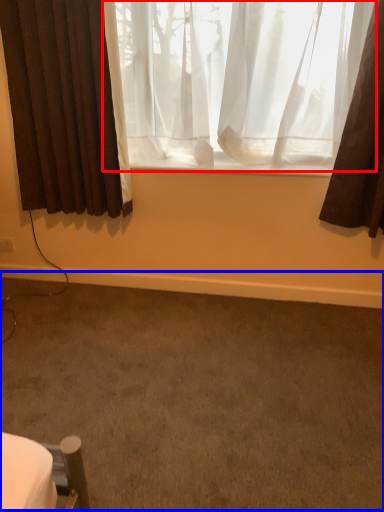
Question: Among these objects, which one is nearest to the camera, curtain (highlighted by a red box) or plain (highlighted by a blue box)?

Choices:
 (A) curtain
 (B) plain

Answer: (B)